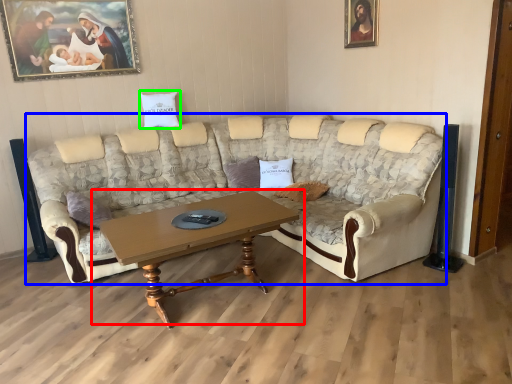
Question: Estimate the real-world distances between objects in this image. Which object is closer to coffee table (highlighted by a red box), studio couch (highlighted by a blue box) or pillow (highlighted by a green box)?

Choices:
 (A) studio couch
 (B) pillow

Answer: (A)